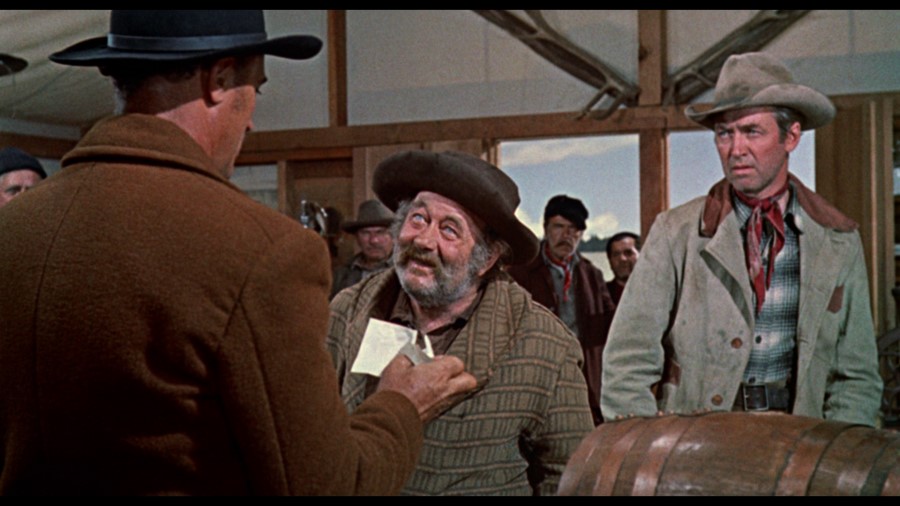
Locate an element on the screen. The width and height of the screenshot is (900, 506). doorways is located at coordinates (574, 170), (702, 174).